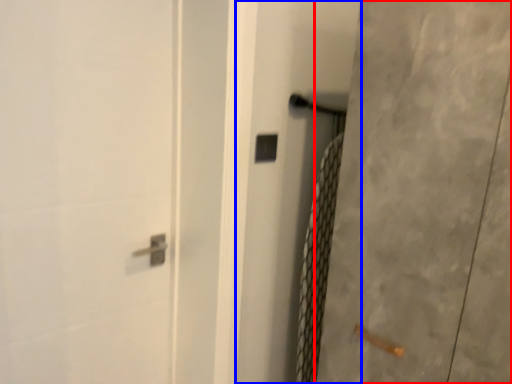
Question: Which point is further to the camera, screen door (highlighted by a red box) or screen door (highlighted by a blue box)?

Choices:
 (A) screen door
 (B) screen door

Answer: (B)